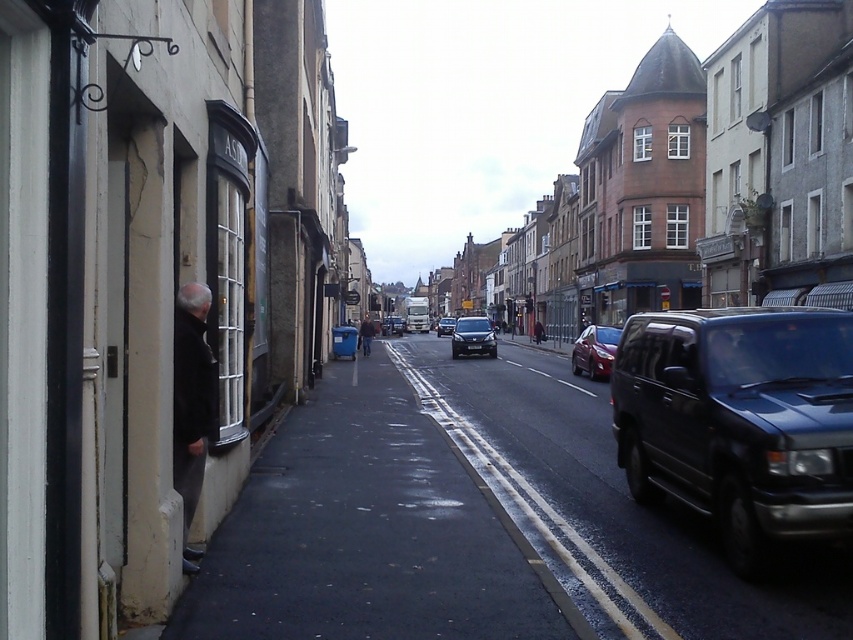
Question: Which object is closer to the camera taking this photo?

Choices:
 (A) dark gray concrete sidewalk at lower left
 (B) shiny silver sedan at center

Answer: (A)

Question: Can you confirm if shiny silver sedan at center is thinner than dark blue jacket at center?

Choices:
 (A) yes
 (B) no

Answer: (A)

Question: Does shiny red car at center appear under metallic silver van at center?

Choices:
 (A) yes
 (B) no

Answer: (A)

Question: Which point is farther to the camera?

Choices:
 (A) (383, 317)
 (B) (454, 352)
 (C) (605, 362)
 (D) (198, 403)

Answer: (A)

Question: Which point is farther to the camera?

Choices:
 (A) shiny red car at center
 (B) black plastic license plate at center
 (C) dark gray concrete sidewalk at lower left

Answer: (B)

Question: Is dark gray coat at left smaller than metallic silver van at center?

Choices:
 (A) no
 (B) yes

Answer: (B)